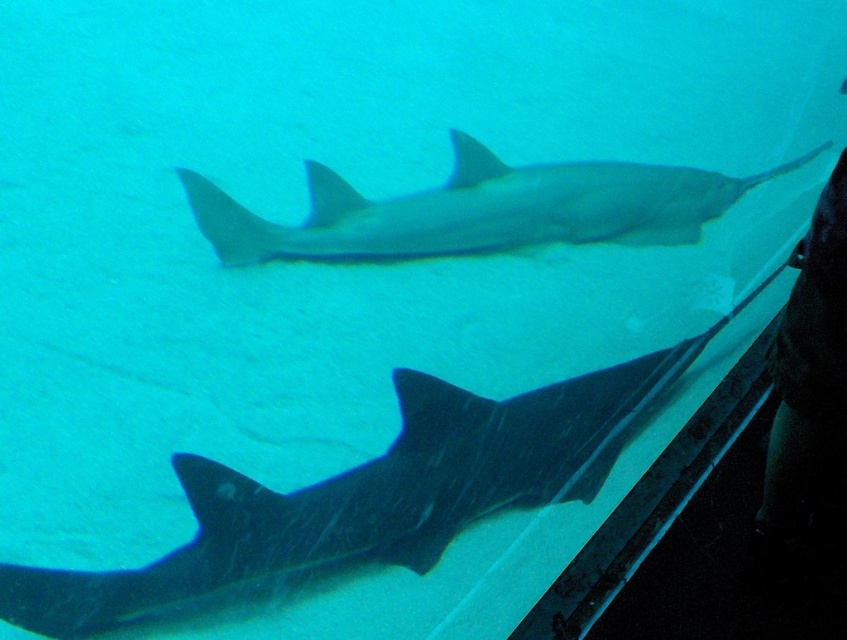
You are an underwater photographer aiming to capture a clear image of the dark gray textured shark at center. Based on its position, will it be in the center of the frame?

The dark gray textured shark at center is located at point (360, 502), which means it is not exactly at the center of the frame but slightly shifted towards the right and bottom. Therefore, it will not be perfectly centered in the photo.

You are an aquarium staff member tasked with ensuring the sharks have enough space to swim comfortably. The dark gray textured shark at center and the smooth gray shark at center are both in the same tank. Based on their sizes, which shark requires a wider space to move around?

The smooth gray shark at center requires a wider space to move around since its width is greater than the dark gray textured shark at center.

You are a marine biologist observing the sharks in the aquarium. You notice both the dark gray textured shark at center and the smooth gray shark at center. Which shark is positioned lower in the water?

The dark gray textured shark at center is positioned lower in the water than the smooth gray shark at center.